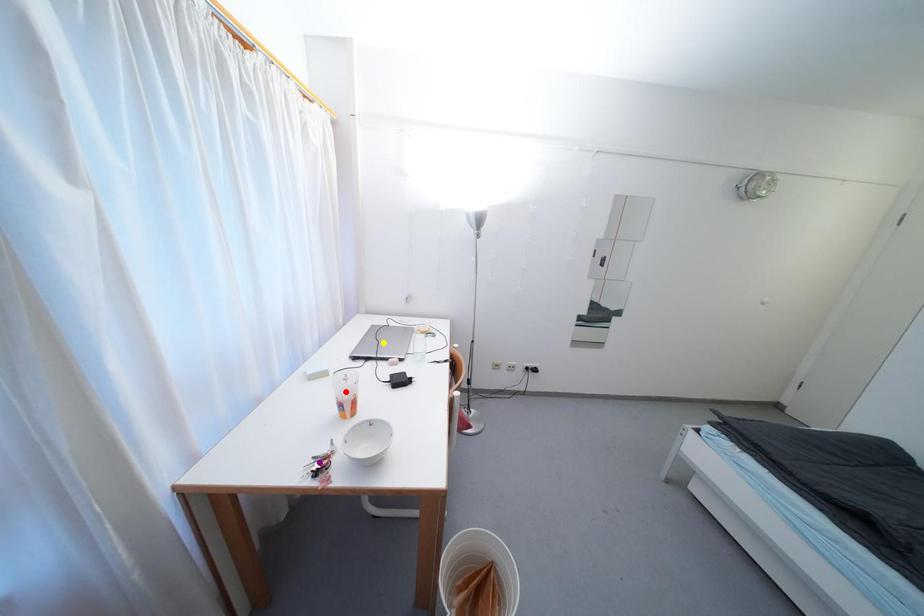
Order these from nearest to farthest:
1. red point
2. purple point
3. yellow point

1. purple point
2. red point
3. yellow point